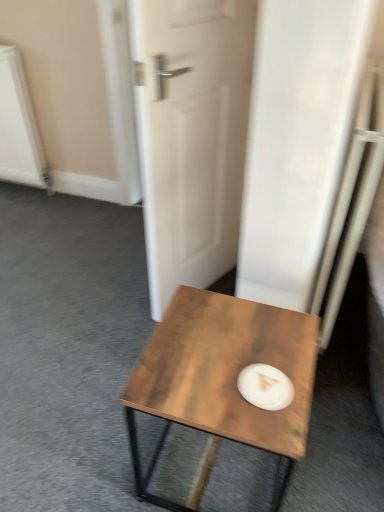
You are a GUI agent. You are given a task and a screenshot of the screen. Output one action in this format:
    pyautogui.click(x=<x>, y=<y>)
    Task: Click on the vacant region to the left of white matte paper plate at center
    This screenshot has height=512, width=384.
    Given the screenshot: What is the action you would take?
    pyautogui.click(x=192, y=378)